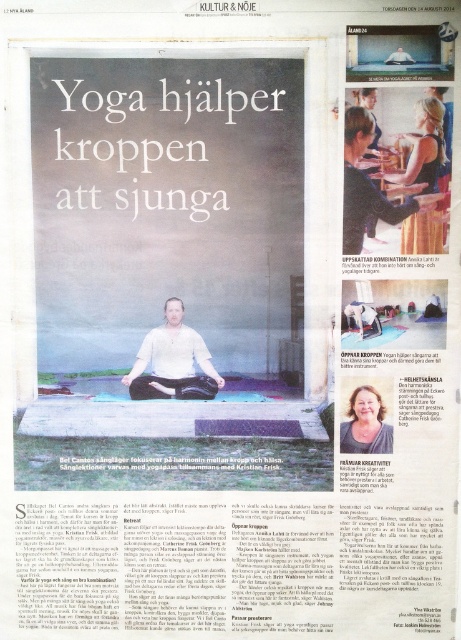
Based on the scene described, which object occupies more space in the image? The white matte shirt at center or the matte brown hair at lower right?

The white matte shirt at center has a larger size compared to matte brown hair at lower right, so it occupies more space in the image.

You are a fashion designer looking at this newspaper page. You notice two items labeled as white matte shirt at center and matte white shirt at center. Which one is closer to the bottom of the page?

The white matte shirt at center is positioned under the matte white shirt at center, so the white matte shirt at center is closer to the bottom of the page.

You are a photographer adjusting your camera to focus on two points in the image. The first point is point (353, 401) and the second is point (358, 301). Which point should you focus on first if you want to ensure the foreground is sharp?

You should focus on point (353, 401) first because it is closer to the camera than point (358, 301), ensuring the foreground elements are in sharp focus.